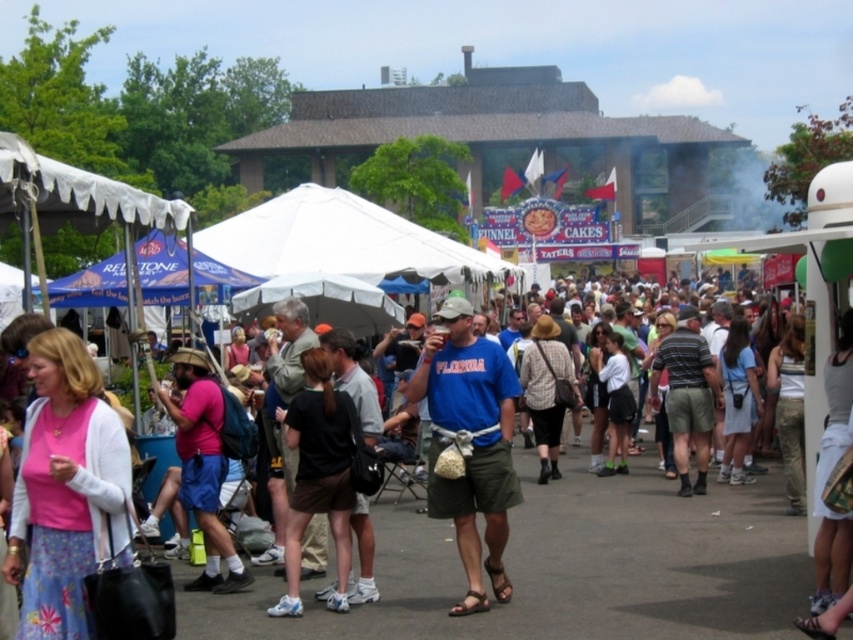
Question: Which of the following is the closest to the observer?

Choices:
 (A) black fabric shirt at center
 (B) blue cotton shirt at center
 (C) pink fabric shirt at center

Answer: (A)

Question: Among these objects, which one is farthest from the camera?

Choices:
 (A) pink fabric blouse at center
 (B) pink fabric shirt at center
 (C) black fabric shirt at center
 (D) blue cotton shirt at center

Answer: (B)

Question: Which of these objects is positioned closest to the pink fabric shirt at center?

Choices:
 (A) black fabric shirt at center
 (B) pink fabric blouse at center

Answer: (A)

Question: Is blue cotton shirt at center smaller than black fabric shirt at center?

Choices:
 (A) yes
 (B) no

Answer: (A)

Question: Can you confirm if pink fabric blouse at center is positioned to the left of blue cotton shirt at center?

Choices:
 (A) yes
 (B) no

Answer: (A)

Question: Does black fabric shirt at center appear under pink fabric shirt at center?

Choices:
 (A) yes
 (B) no

Answer: (B)